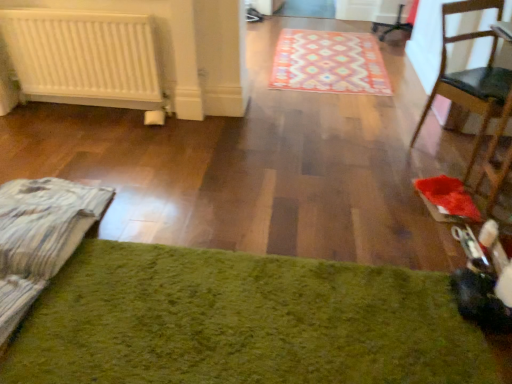
Question: From their relative heights in the image, would you say green shaggy rug at lower center, which is the first mat from bottom to top, is taller or shorter than patterned carpet at center, positioned as the 1th mat in back-to-front order?

Choices:
 (A) short
 (B) tall

Answer: (B)

Question: Which is correct: green shaggy rug at lower center, which is the first mat from bottom to top, is inside patterned carpet at center, the 1th mat from the top, or outside of it?

Choices:
 (A) outside
 (B) inside

Answer: (A)

Question: Which is farther from the green shaggy rug at lower center, the second mat in the back-to-front sequence?

Choices:
 (A) patterned carpet at center, which ranks as the second mat in front-to-back order
 (B) white matte radiator at left
 (C) wooden chair at right

Answer: (A)

Question: Considering the real-world distances, which object is closest to the green shaggy rug at lower center, the second mat in the back-to-front sequence?

Choices:
 (A) white matte radiator at left
 (B) wooden chair at right
 (C) patterned carpet at center, positioned as the 2th mat in bottom-to-top order

Answer: (B)